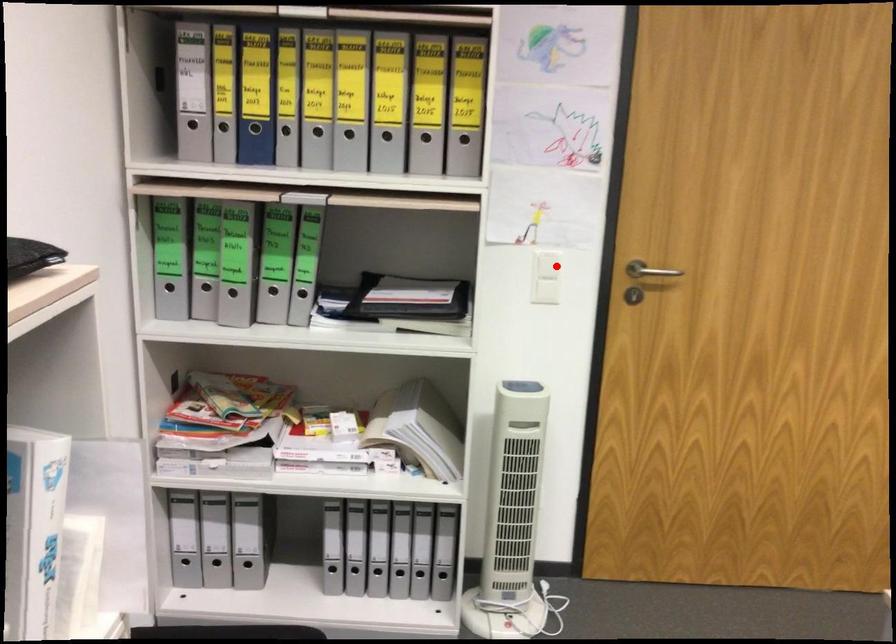
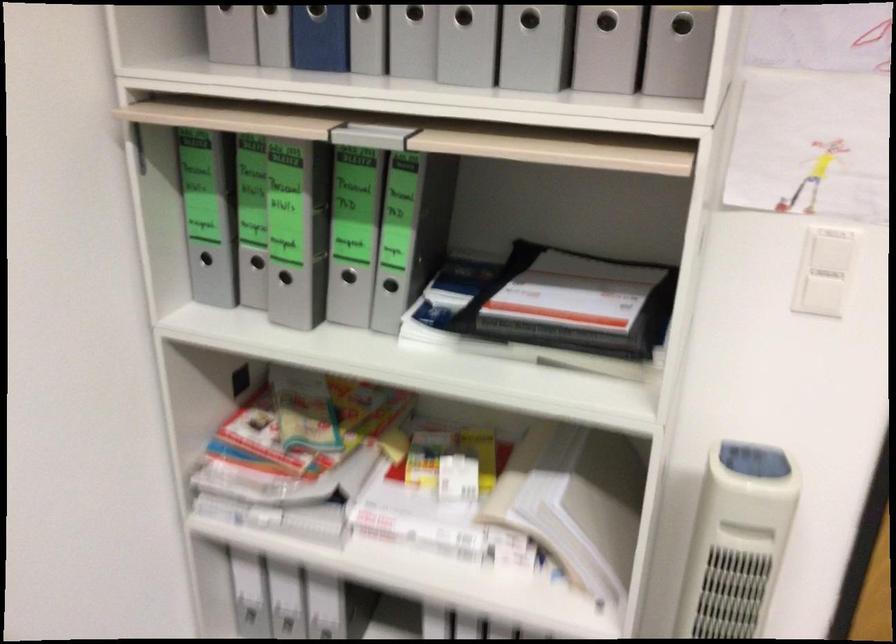
Question: A red point is marked in image1. In image2, is the corresponding 3D point closer to the camera or farther? Reply with the corresponding letter.

Choices:
 (A) The corresponding 3D point is closer.
 (B) The corresponding 3D point is farther.

Answer: (A)